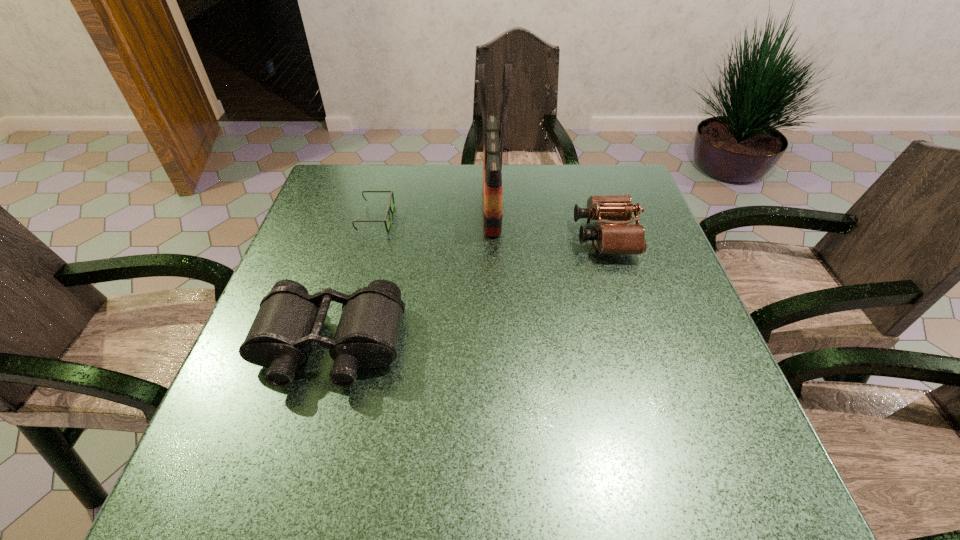
This screenshot has height=540, width=960. In order to click on object located in the far left corner section of the desktop in this screenshot , I will do `click(389, 209)`.

In the image, there is a desktop. At what (x,y) coordinates should I click in order to perform the action: click on vacant region at the far edge. Please return your answer as a coordinate pair (x, y). Looking at the image, I should click on (506, 176).

The width and height of the screenshot is (960, 540). In the image, there is a desktop. In order to click on vacant space at the near edge in this screenshot , I will do `click(483, 484)`.

Find the location of a particular element. Image resolution: width=960 pixels, height=540 pixels. vacant space at the left edge of the desktop is located at coordinates (361, 214).

In the image, there is a desktop. Where is `vacant area at the right edge`? vacant area at the right edge is located at coordinates (647, 274).

Identify the location of free space at the far left corner of the desktop. Image resolution: width=960 pixels, height=540 pixels. (350, 184).

In the image, there is a desktop. Identify the location of free space at the far right corner. click(x=590, y=194).

In the image, there is a desktop. Identify the location of blank space at the near right corner. (707, 470).

Locate an element on the screen. free space between the nearest object and the rightmost object is located at coordinates (468, 291).

Find the location of a particular element. free space that is in between the right binoculars and the third object from left to right is located at coordinates (548, 221).